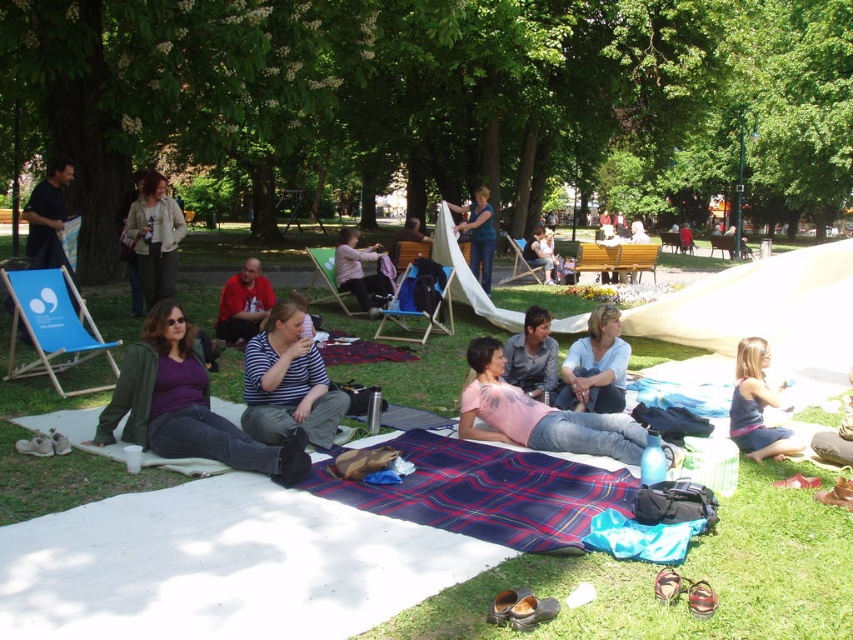
Question: Based on their relative distances, which object is farther from the green grass at center?

Choices:
 (A) matte pink shirt at center
 (B) matte blue tank top at lower right

Answer: (A)

Question: Which object appears closest to the camera in this image?

Choices:
 (A) striped fabric shirt at center
 (B) matte pink shirt at center
 (C) denim shirt at center

Answer: (A)

Question: From the image, what is the correct spatial relationship of striped fabric shirt at center in relation to matte blue shirt at center?

Choices:
 (A) left
 (B) right

Answer: (A)

Question: Does green grass at center lie in front of striped shirt at center?

Choices:
 (A) yes
 (B) no

Answer: (A)

Question: Which is nearer to the denim shirt at center?

Choices:
 (A) striped shirt at center
 (B) matte blue tank top at lower right

Answer: (B)

Question: Can you confirm if matte beige jacket at center is bigger than matte red shirt at center?

Choices:
 (A) yes
 (B) no

Answer: (A)